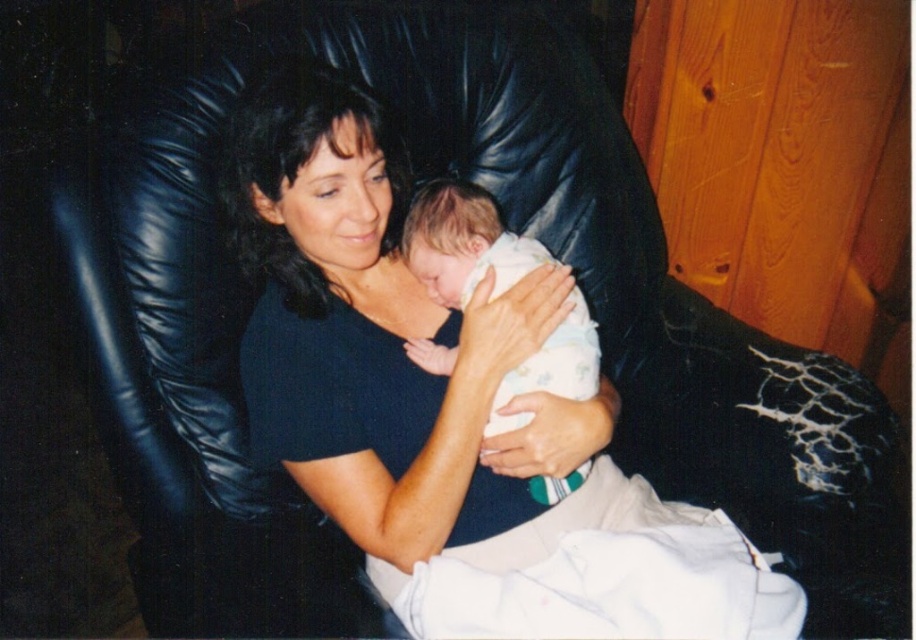
You are a photographer setting up for a portrait. You need to ensure that the black matte shirt at center and the white clothed baby at center are both clearly visible in the frame. Based on their sizes, which object might require more careful positioning to avoid being obscured?

The black matte shirt at center might be wider than the white clothed baby at center, so the baby may need more careful positioning to ensure it isn not obscured by the shirt.

You are a photographer adjusting your camera to focus on two points in the image. The first point is at coordinates point [410,440] and the second is at point [531,376]. Which point should you focus on first if you want to capture the closest object to the camera?

Point [410,440] is further to the viewer than point [531,376], so you should focus on point [410,440] first because it is closer to the camera.

Consider the image. You are a photographer setting up a portrait session. You have a backdrop that requires the subject to be at least 1.2 meters tall. The black matte shirt at center belongs to the woman, and the white clothed baby at center is the baby. Considering their heights, can both the woman and the baby stand on the backdrop together without violating the height requirement?

The black matte shirt at center is much taller than the white clothed baby at center. Since the woman wearing the black matte shirt at center is taller than 1.2 meters, she can stand on the backdrop. However, the white clothed baby at center is shorter, so it may not meet the height requirement. Therefore, only the woman can stand on the backdrop while the baby might need to be held or seated.